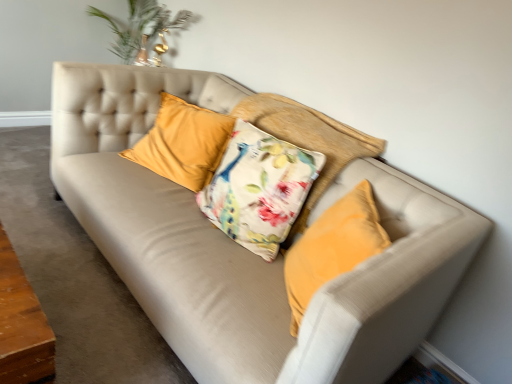
Question: Which direction should I rotate to face velvet yellow pillow at center, marked as the 2th pillow in a right-to-left arrangement, — up or down?

Choices:
 (A) down
 (B) up

Answer: (B)

Question: From a real-world perspective, is suede beige couch at center located higher than floral fabric cushion at center, the 2th pillow in the left-to-right sequence?

Choices:
 (A) yes
 (B) no

Answer: (B)

Question: Is suede beige couch at center aimed at floral fabric cushion at center, the 2th pillow in the left-to-right sequence?

Choices:
 (A) no
 (B) yes

Answer: (A)

Question: Is suede beige couch at center looking in the opposite direction of floral fabric cushion at center, the 2th pillow in the left-to-right sequence?

Choices:
 (A) no
 (B) yes

Answer: (A)

Question: Considering the relative positions of suede beige couch at center and floral fabric cushion at center, the 1th pillow from the right, in the image provided, is suede beige couch at center behind floral fabric cushion at center, the 1th pillow from the right,?

Choices:
 (A) yes
 (B) no

Answer: (B)

Question: Is suede beige couch at center positioned far away from floral fabric cushion at center, the 1th pillow from the right?

Choices:
 (A) yes
 (B) no

Answer: (B)

Question: Does suede beige couch at center have a lesser width compared to floral fabric cushion at center, the 1th pillow from the right?

Choices:
 (A) yes
 (B) no

Answer: (B)

Question: Is floral fabric cushion at center, the 2th pillow in the left-to-right sequence, to the left of velvet yellow pillow at center, marked as the 2th pillow in a right-to-left arrangement, from the viewer's perspective?

Choices:
 (A) no
 (B) yes

Answer: (A)

Question: Is floral fabric cushion at center, the 1th pillow from the right, smaller than velvet yellow pillow at center, marked as the 2th pillow in a right-to-left arrangement?

Choices:
 (A) no
 (B) yes

Answer: (A)

Question: Can you confirm if floral fabric cushion at center, the 1th pillow from the right, is thinner than velvet yellow pillow at center, marked as the 2th pillow in a right-to-left arrangement?

Choices:
 (A) no
 (B) yes

Answer: (A)

Question: Does floral fabric cushion at center, the 2th pillow in the left-to-right sequence, come behind velvet yellow pillow at center, the first pillow positioned from the left?

Choices:
 (A) no
 (B) yes

Answer: (A)

Question: Can you confirm if floral fabric cushion at center, the 2th pillow in the left-to-right sequence, is bigger than velvet yellow pillow at center, marked as the 2th pillow in a right-to-left arrangement?

Choices:
 (A) yes
 (B) no

Answer: (A)

Question: Is velvet yellow pillow at center, marked as the 2th pillow in a right-to-left arrangement, at the back of floral fabric cushion at center, the 1th pillow from the right?

Choices:
 (A) no
 (B) yes

Answer: (A)

Question: Can you confirm if velvet yellow pillow at center, marked as the 2th pillow in a right-to-left arrangement, is smaller than suede beige couch at center?

Choices:
 (A) no
 (B) yes

Answer: (B)